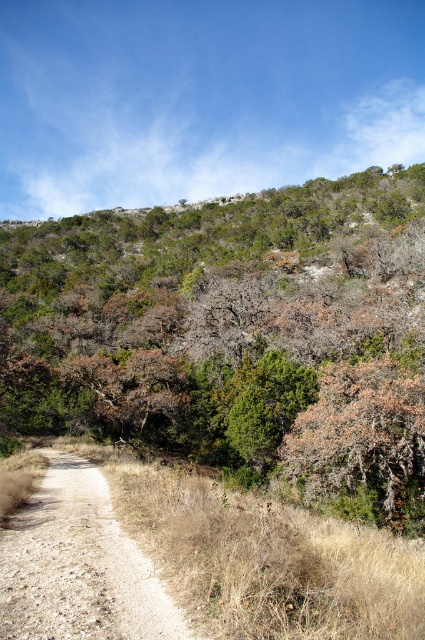
Question: Which point appears farthest from the camera in this image?

Choices:
 (A) (362, 300)
 (B) (142, 618)

Answer: (A)

Question: Is green leafy tree at center behind brown gravel path at lower left?

Choices:
 (A) no
 (B) yes

Answer: (B)

Question: Which point is closer to the camera?

Choices:
 (A) (16, 531)
 (B) (385, 472)

Answer: (A)

Question: Is green leafy tree at center positioned in front of brown gravel path at lower left?

Choices:
 (A) no
 (B) yes

Answer: (A)

Question: Is green leafy tree at center positioned before brown gravel path at lower left?

Choices:
 (A) no
 (B) yes

Answer: (A)